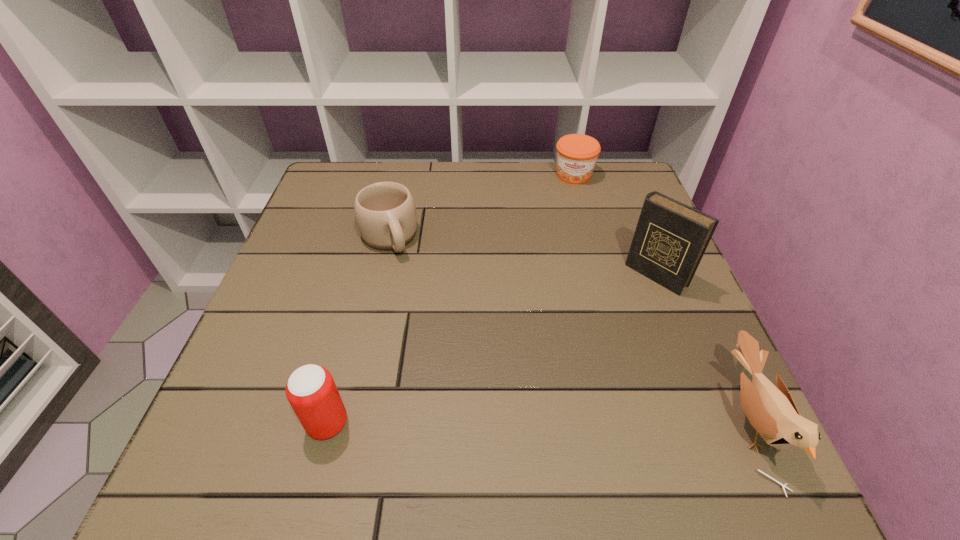
Find the location of a particular element. This screenshot has height=540, width=960. free space at the far edge of the desktop is located at coordinates tap(469, 167).

In the image, there is a desktop. In order to click on vacant space at the near edge in this screenshot , I will do `click(569, 423)`.

This screenshot has height=540, width=960. Find the location of `free space at the left edge of the desktop`. free space at the left edge of the desktop is located at coordinates (246, 372).

The height and width of the screenshot is (540, 960). In order to click on vacant space at the right edge in this screenshot , I will do `click(682, 359)`.

The width and height of the screenshot is (960, 540). Identify the location of vacant space at the far left corner. (375, 161).

At what (x,y) coordinates should I click in order to perform the action: click on vacant space at the near left corner of the desktop. Please return your answer as a coordinate pair (x, y). This screenshot has height=540, width=960. Looking at the image, I should click on (248, 384).

Identify the location of vacant space that is in between the third object from left to right and the mug. This screenshot has height=540, width=960. (481, 206).

The width and height of the screenshot is (960, 540). I want to click on free space between the tallest object and the mug, so click(522, 256).

Image resolution: width=960 pixels, height=540 pixels. Identify the location of vacant area that lies between the third object from right to left and the beer can. (450, 299).

Image resolution: width=960 pixels, height=540 pixels. Find the location of `free point between the mug and the bird`. free point between the mug and the bird is located at coordinates (569, 329).